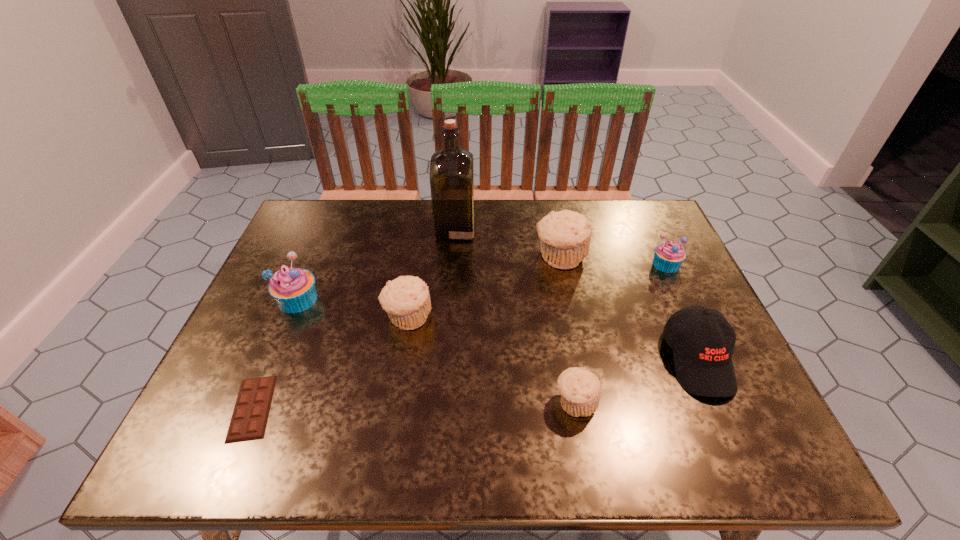
I want to click on vacant space located 0.320m on the right of the shortest object, so click(x=432, y=408).

Find the location of a particular element. liquor located in the far edge section of the desktop is located at coordinates (451, 169).

Where is `muffin that is at the far edge`? The image size is (960, 540). muffin that is at the far edge is located at coordinates (565, 236).

Where is `muffin at the near edge`? muffin at the near edge is located at coordinates (580, 390).

Identify the location of chocolate bar that is at the near edge. (249, 419).

Find the location of a particular element. The image size is (960, 540). muffin located at the left edge is located at coordinates (293, 288).

Find the location of `chocolate bar present at the left edge`. chocolate bar present at the left edge is located at coordinates (249, 419).

The height and width of the screenshot is (540, 960). I want to click on baseball cap situated at the right edge, so click(703, 341).

Locate an element on the screen. muffin at the right edge is located at coordinates (668, 256).

You are a GUI agent. You are given a task and a screenshot of the screen. Output one action in this format:
    pyautogui.click(x=<x>, y=<y>)
    Task: Click on the object that is at the near left corner
    
    Given the screenshot: What is the action you would take?
    pyautogui.click(x=249, y=419)